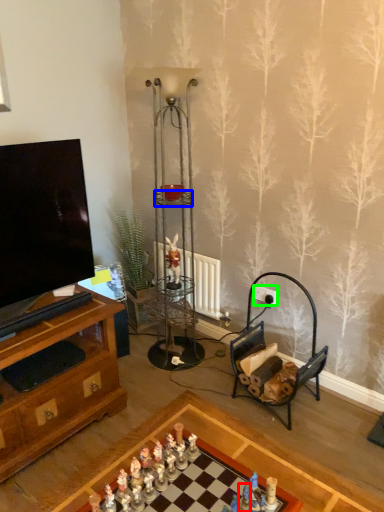
Question: Considering the real-world distances, which object is closest to toy (highlighted by a red box)? shelf (highlighted by a blue box) or power outlet (highlighted by a green box).

Choices:
 (A) shelf
 (B) power outlet

Answer: (B)